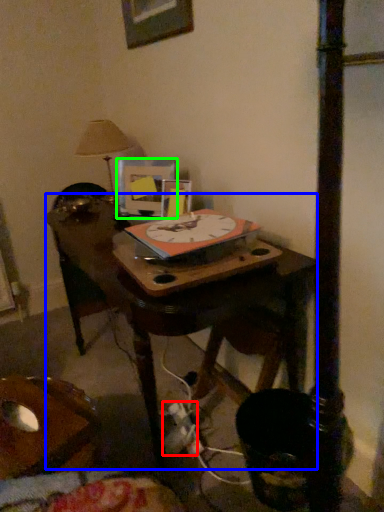
Question: Considering the real-world distances, which object is closest to plug (highlighted by a red box)? table (highlighted by a blue box) or picture frame (highlighted by a green box).

Choices:
 (A) table
 (B) picture frame

Answer: (A)